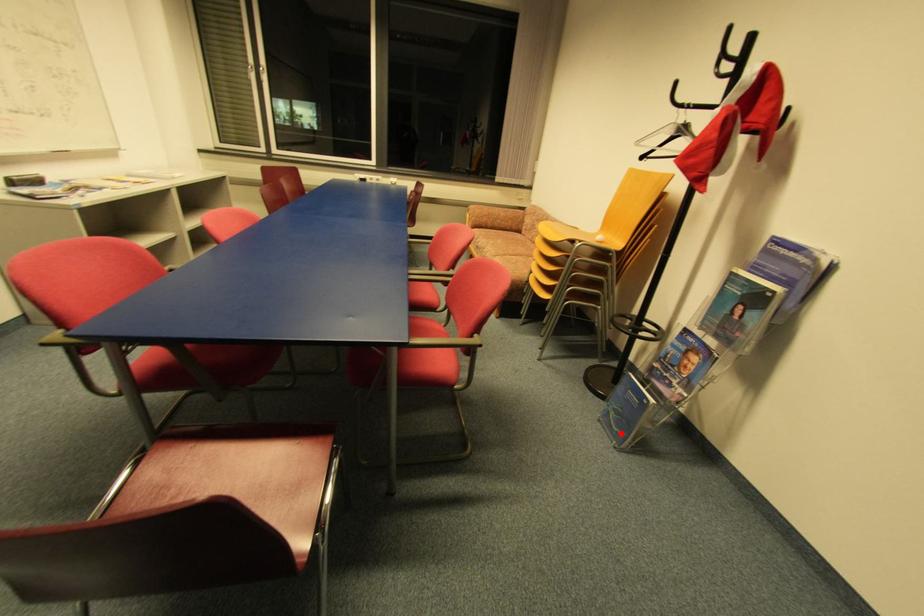
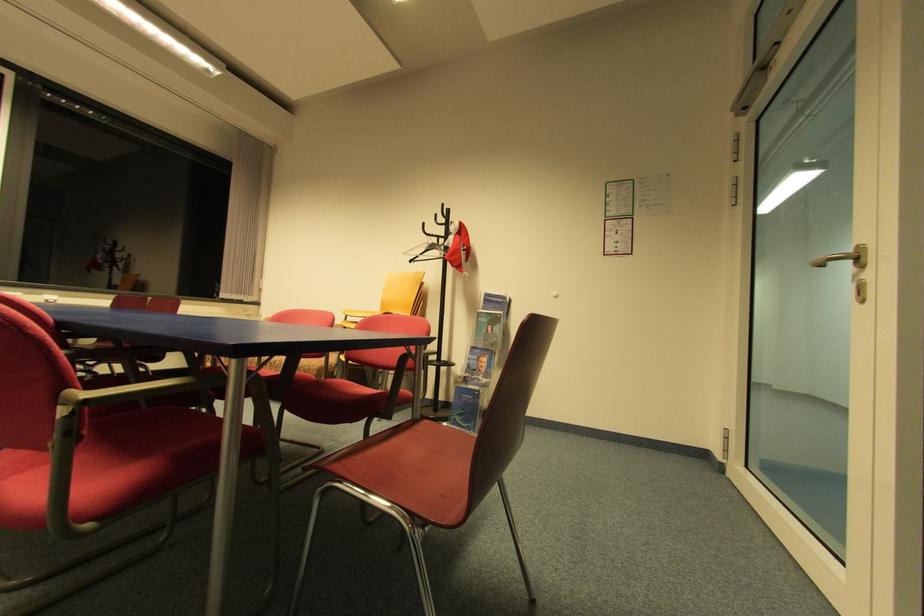
Question: I am providing you with two images of the same scene from different viewpoints. In image1, a red point is highlighted. Considering the same 3D point in image2, which of the following is correct?

Choices:
 (A) It is closer
 (B) It is farther

Answer: (B)